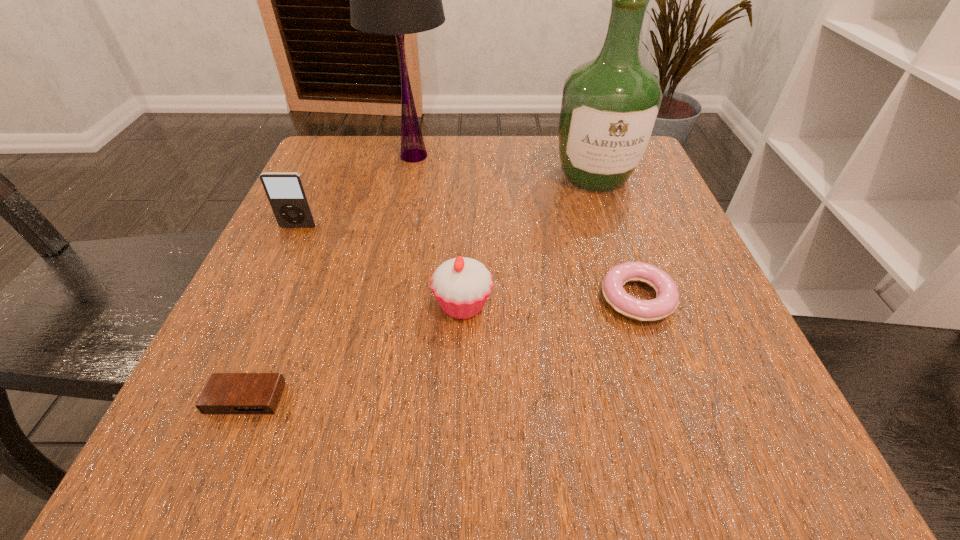
The height and width of the screenshot is (540, 960). Identify the location of free region located 0.130m on the front-facing side of the iPod. (275, 278).

You are a GUI agent. You are given a task and a screenshot of the screen. Output one action in this format:
    pyautogui.click(x=<x>, y=<y>)
    Task: Click on the vacant area situated 0.330m on the back of the cupcake
    The image size is (960, 540).
    Given the screenshot: What is the action you would take?
    pyautogui.click(x=468, y=174)

Where is `vacant space located on the back of the doughnut`? The image size is (960, 540). vacant space located on the back of the doughnut is located at coordinates (588, 154).

Where is `free space located 0.070m on the front face of the nearest object`? free space located 0.070m on the front face of the nearest object is located at coordinates (216, 471).

This screenshot has width=960, height=540. What are the coordinates of `lampshade located in the far edge section of the desktop` in the screenshot? It's located at (396, 0).

Identify the location of liquor that is at the far edge. (610, 105).

Image resolution: width=960 pixels, height=540 pixels. I want to click on object located in the near edge section of the desktop, so click(225, 393).

What are the coordinates of `lampshade that is at the left edge` in the screenshot? It's located at (396, 0).

Find the location of a particular element. iPod present at the left edge is located at coordinates (286, 192).

Where is `alarm clock that is at the left edge`? The image size is (960, 540). alarm clock that is at the left edge is located at coordinates (225, 393).